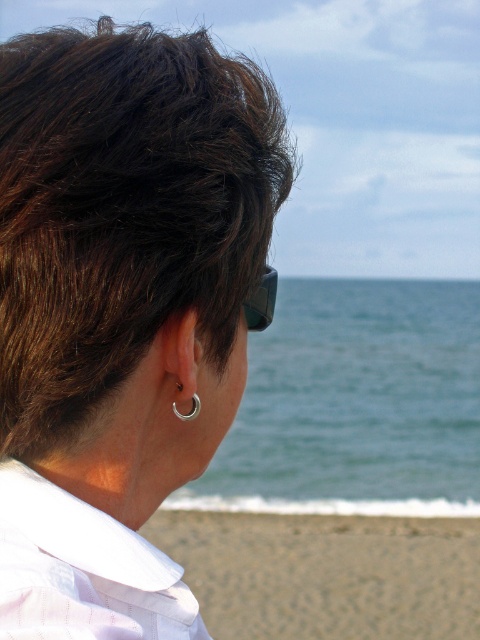
Is point (432, 595) less distant than point (182, 355)?

No, (432, 595) is further to viewer.

What do you see at coordinates (325, 572) in the screenshot? I see `sandy beach at lower right` at bounding box center [325, 572].

What do you see at coordinates (325, 572) in the screenshot?
I see `sandy beach at lower right` at bounding box center [325, 572].

Locate an element on the screen. sandy beach at lower right is located at coordinates (325, 572).

Can you confirm if white striped shirt at center is positioned to the left of matte black goggles at upper center?

Correct, you'll find white striped shirt at center to the left of matte black goggles at upper center.

Measure the distance between point (x=164, y=612) and camera.

Point (x=164, y=612) is 37.80 inches away from camera.

Identify the location of white striped shirt at center. The image size is (480, 640). (82, 570).

Which of these two, white striped shirt at center or silver/polished metal earring at center-left, stands shorter?

Standing shorter between the two is silver/polished metal earring at center-left.

Who is taller, white striped shirt at center or silver/polished metal earring at center-left?

white striped shirt at center is taller.

Is point (112, 545) farther from viewer compared to point (184, 326)?

No, (112, 545) is in front of (184, 326).

Where is `white striped shirt at center`? The width and height of the screenshot is (480, 640). white striped shirt at center is located at coordinates (82, 570).